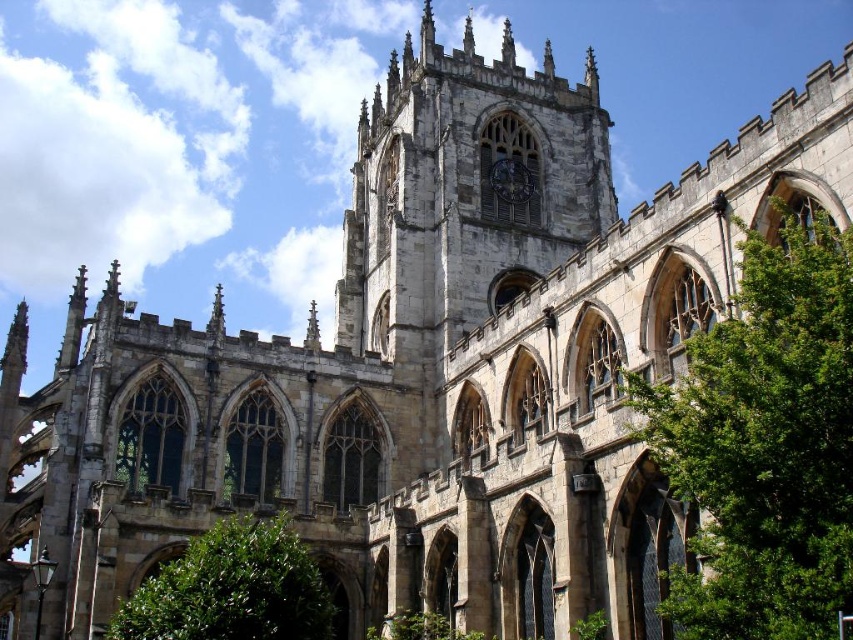
Question: Which of the following is the farthest from the observer?

Choices:
 (A) (169, 592)
 (B) (822, 452)

Answer: (A)

Question: From the image, what is the correct spatial relationship of green leafy tree at right in relation to dark gray stone clock at center?

Choices:
 (A) below
 (B) above

Answer: (A)

Question: Does green leafy bush at lower left appear on the right side of dark gray stone clock at center?

Choices:
 (A) yes
 (B) no

Answer: (B)

Question: Is green leafy tree at right in front of dark gray stone clock at center?

Choices:
 (A) no
 (B) yes

Answer: (B)

Question: Which object is positioned farthest from the dark gray stone clock at center?

Choices:
 (A) green leafy tree at right
 (B) green leafy bush at lower left

Answer: (A)

Question: Which of the following is the closest to the observer?

Choices:
 (A) green leafy bush at lower left
 (B) green leafy tree at right
 (C) dark gray stone clock at center

Answer: (B)